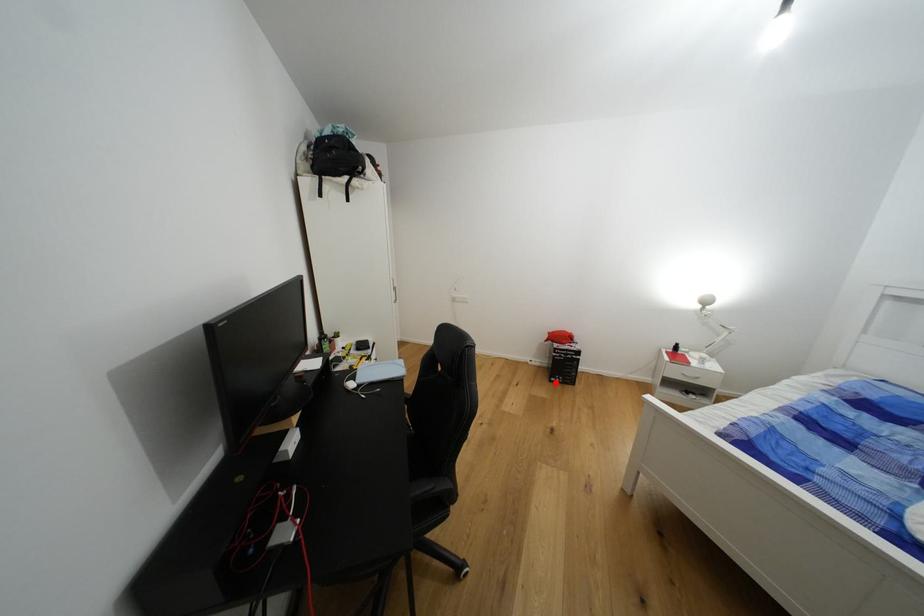
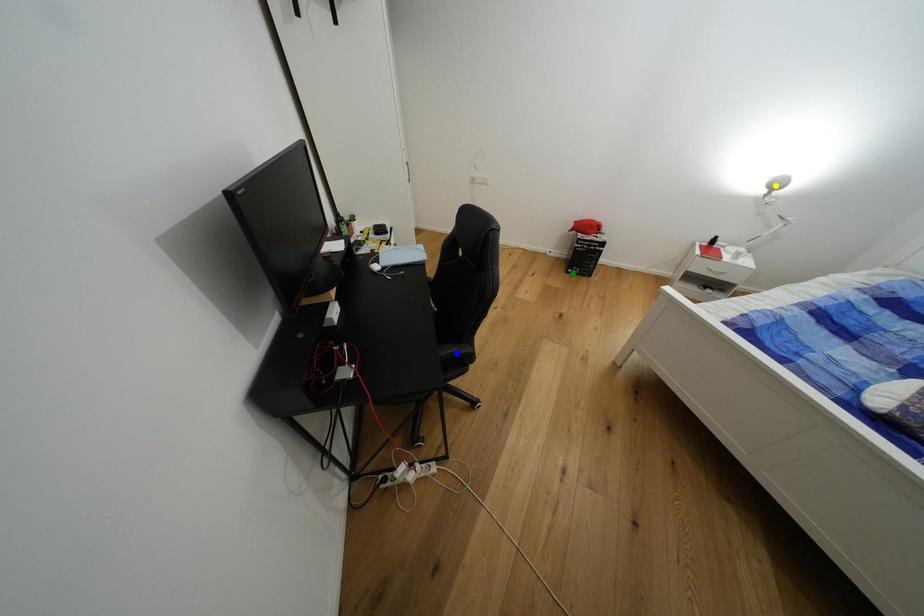
Question: I am providing you with two images of the same scene from different viewpoints. A red point is marked on the first image. You are given multiple points on the second image. Which point in image 2 is actually the same real-world point as the red point in image 1?

Choices:
 (A) blue point
 (B) yellow point
 (C) green point

Answer: (C)